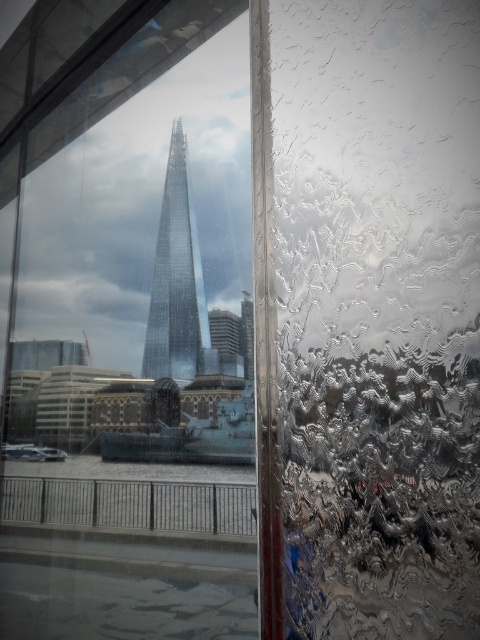
Question: Can you confirm if transparent glass window at center is wider than transparent glass tower at center?

Choices:
 (A) no
 (B) yes

Answer: (B)

Question: Among these objects, which one is farthest from the camera?

Choices:
 (A) transparent glass tower at center
 (B) transparent glass window at center

Answer: (A)

Question: Among these objects, which one is nearest to the camera?

Choices:
 (A) transparent glass window at center
 (B) transparent glass tower at center

Answer: (A)

Question: In this image, where is transparent glass window at center located relative to transparent glass tower at center?

Choices:
 (A) right
 (B) left

Answer: (B)

Question: Can you confirm if transparent glass window at center is positioned below transparent glass tower at center?

Choices:
 (A) yes
 (B) no

Answer: (A)